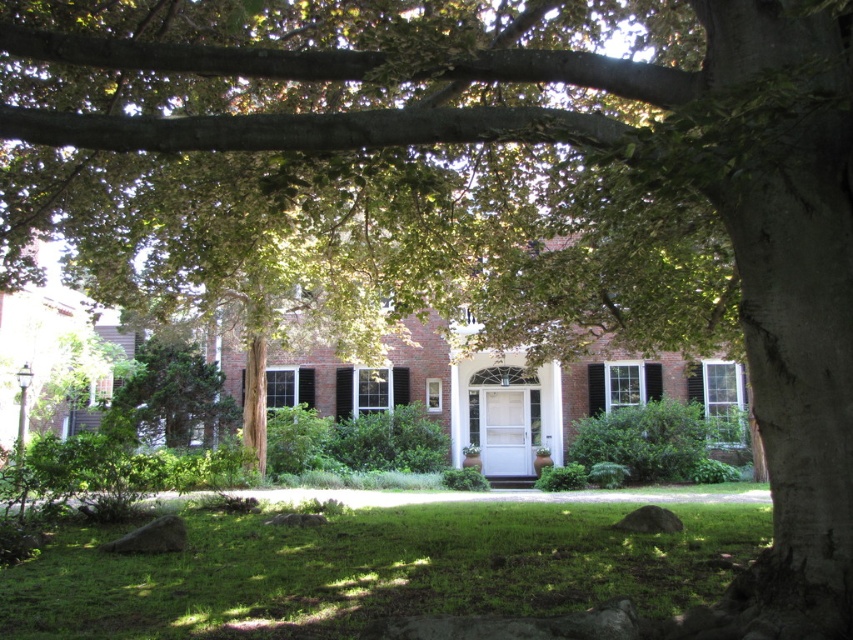
You are a window installer assessing the house in the image. You need to replace the shutters on both sides of the front door. The white painted wood shutter at center is taller than the black wood shutter at center. Which shutter requires a longer ladder to reach its top?

The white painted wood shutter at center requires a longer ladder because it is taller than the black wood shutter at center.

You are standing in front of the brick house and notice two shutters, the white painted wood shutter at center and the black wood shutter at center. Which one is positioned lower on the house?

The white painted wood shutter at center is located below the black wood shutter at center, so it is positioned lower on the house.

You are standing in the front yard of the house and need to place a 30 feet long decorative fence between the white painted wood shutter at center and the black wood shutter at center. Can the fence fit between them?

The white painted wood shutter at center and black wood shutter at center are 34.39 feet apart from each other. Since the fence is 30 feet long, it can fit between them as there is enough space.